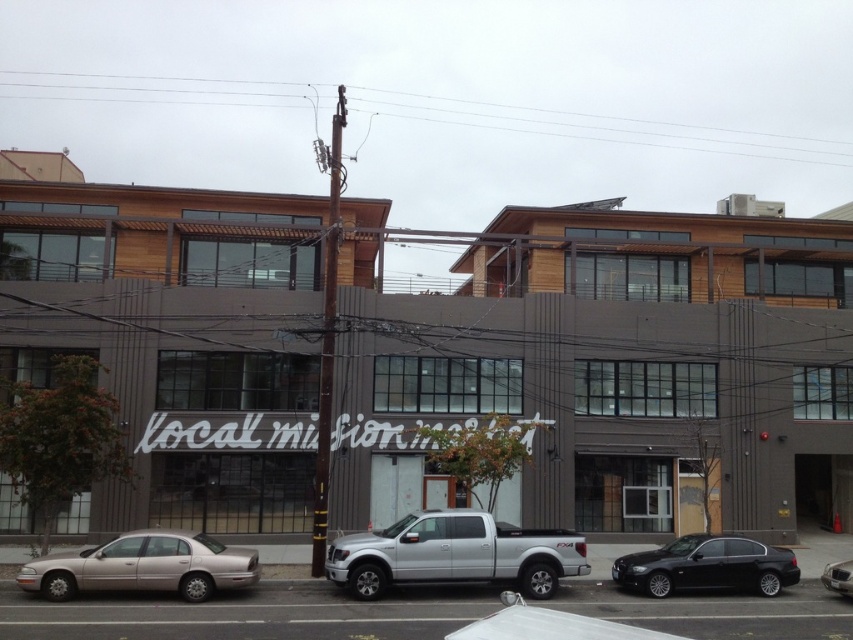
Question: Is silver metallic truck at center positioned in front of metallic silver sedan at center?

Choices:
 (A) no
 (B) yes

Answer: (B)

Question: In this image, where is silver metallic truck at lower center located relative to black metallic sedan at lower right?

Choices:
 (A) left
 (B) right

Answer: (A)

Question: Which point is closer to the camera?

Choices:
 (A) metallic silver sedan at center
 (B) silver metallic truck at lower center
 (C) silver metallic truck at center
 (D) gold metallic sedan at lower left

Answer: (B)

Question: Among these points, which one is farthest from the camera?

Choices:
 (A) (474, 547)
 (B) (616, 566)

Answer: (B)

Question: Which point is farther to the camera?

Choices:
 (A) (166, 579)
 (B) (314, 628)

Answer: (A)

Question: Is gold metallic sedan at lower left wider than black metallic sedan at lower right?

Choices:
 (A) yes
 (B) no

Answer: (A)